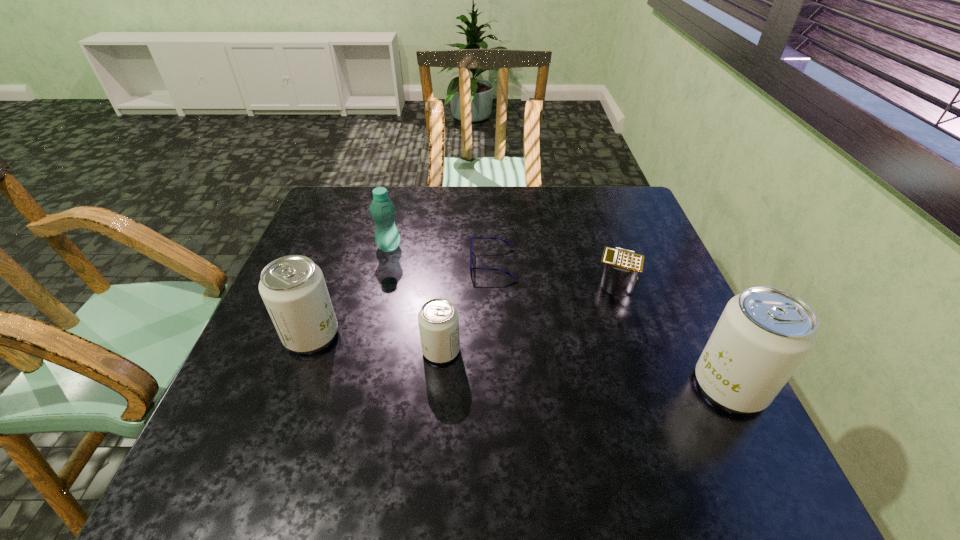
The height and width of the screenshot is (540, 960). In order to click on the leftmost soda can in this screenshot , I will do `click(293, 289)`.

Find the location of a particular element. The height and width of the screenshot is (540, 960). the second shortest soda can is located at coordinates (293, 289).

At what (x,y) coordinates should I click in order to perform the action: click on the second soda can from right to left. Please return your answer as a coordinate pair (x, y). Image resolution: width=960 pixels, height=540 pixels. Looking at the image, I should click on (438, 319).

The width and height of the screenshot is (960, 540). Find the location of `the third shortest object`. the third shortest object is located at coordinates (438, 319).

Where is `the rightmost soda can`? The width and height of the screenshot is (960, 540). the rightmost soda can is located at coordinates (764, 333).

Identify the location of the shortest object. This screenshot has height=540, width=960. (472, 238).

The height and width of the screenshot is (540, 960). Find the location of `the third object from right to left`. the third object from right to left is located at coordinates (472, 238).

Find the location of a particular element. The width and height of the screenshot is (960, 540). the fifth object from right to left is located at coordinates (383, 211).

Locate an element on the screen. This screenshot has width=960, height=540. the fifth tallest object is located at coordinates (622, 266).

Where is `the second object from right to left`? The image size is (960, 540). the second object from right to left is located at coordinates (622, 266).